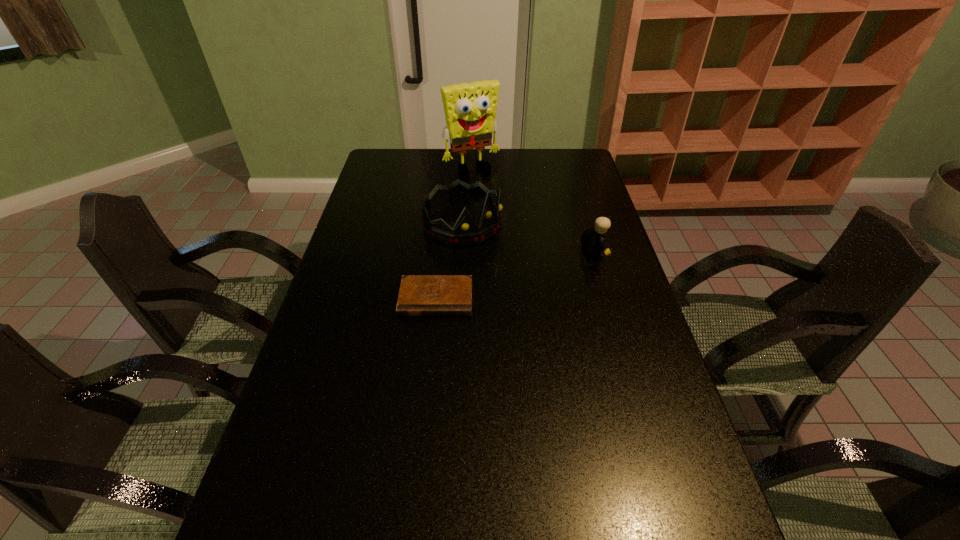
The height and width of the screenshot is (540, 960). Find the location of `free space located 0.110m on the face of the farthest object`. free space located 0.110m on the face of the farthest object is located at coordinates (492, 193).

In order to click on free space located 0.350m at the front of the third shortest object with jewels in this screenshot , I will do `click(574, 296)`.

Image resolution: width=960 pixels, height=540 pixels. In order to click on vacant space situated at the front of the third shortest object with jewels in this screenshot , I will do [505, 252].

Image resolution: width=960 pixels, height=540 pixels. Identify the location of free space located 0.220m at the front of the third shortest object with jewels. (540, 274).

The width and height of the screenshot is (960, 540). Find the location of `object present at the far edge`. object present at the far edge is located at coordinates (470, 108).

Locate an element on the screen. The image size is (960, 540). object present at the right edge is located at coordinates (593, 239).

Locate an element on the screen. The image size is (960, 540). vacant area at the far edge is located at coordinates (509, 165).

Image resolution: width=960 pixels, height=540 pixels. Find the location of `free space at the left edge`. free space at the left edge is located at coordinates (300, 370).

In order to click on vacant space at the right edge of the desktop in this screenshot , I will do `click(628, 446)`.

In the image, there is a desktop. Identify the location of vacant area at the far right corner. The height and width of the screenshot is (540, 960). (563, 158).